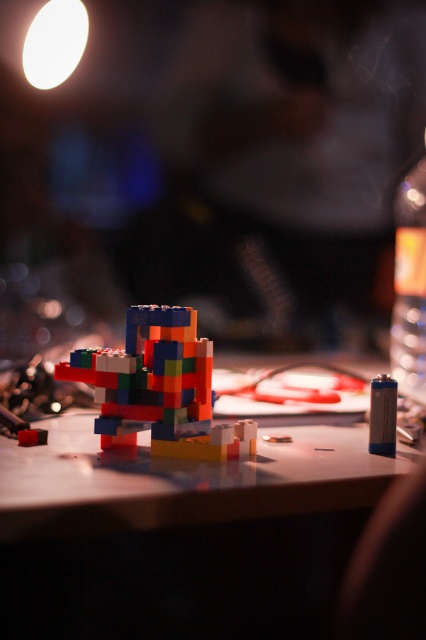
Question: Is matte plastic table at center to the right of transparent plastic bottle at right from the viewer's perspective?

Choices:
 (A) yes
 (B) no

Answer: (B)

Question: Can you confirm if matte plastic table at center is positioned above multicolored plastic toy at center?

Choices:
 (A) no
 (B) yes

Answer: (A)

Question: Among these points, which one is farthest from the camera?

Choices:
 (A) (362, 449)
 (B) (399, 228)

Answer: (B)

Question: Which point is closer to the camera taking this photo?

Choices:
 (A) (412, 228)
 (B) (389, 481)
 (C) (149, 340)

Answer: (B)

Question: Which object is closer to the camera taking this photo?

Choices:
 (A) transparent plastic bottle at right
 (B) matte plastic table at center
 (C) multicolored plastic toy at center

Answer: (B)

Question: Does matte plastic table at center come in front of multicolored plastic toy at center?

Choices:
 (A) no
 (B) yes

Answer: (B)